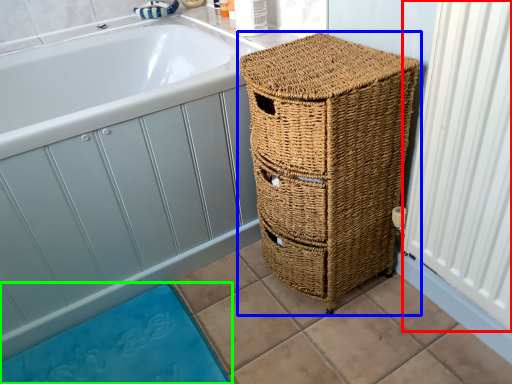
Question: Based on their relative distances, which object is farther from radiator (highlighted by a red box)? Choose from furniture (highlighted by a blue box) and bath mat (highlighted by a green box).

Choices:
 (A) furniture
 (B) bath mat

Answer: (B)